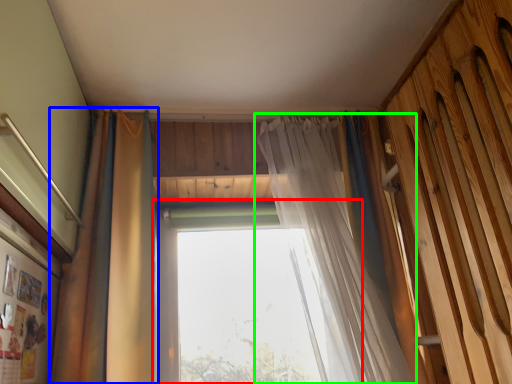
Question: Which is nearer to the window (highlighted by a red box)? curtain (highlighted by a blue box) or curtain (highlighted by a green box).

Choices:
 (A) curtain
 (B) curtain

Answer: (B)